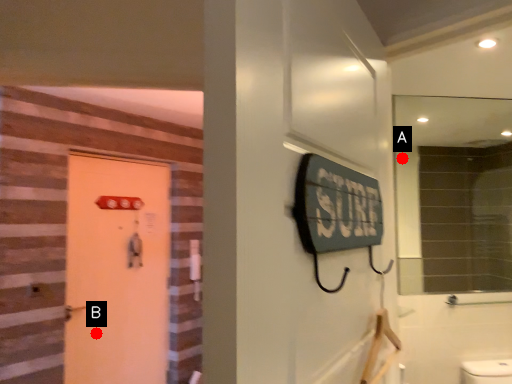
Question: Two points are circled on the image, labeled by A and B beside each circle. Which point is closer to the camera taking this photo?

Choices:
 (A) A is closer
 (B) B is closer

Answer: (B)